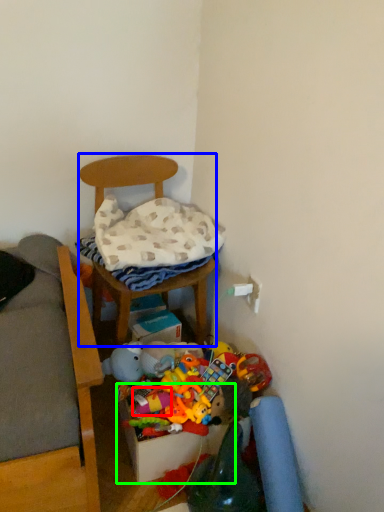
Question: Estimate the real-world distances between objects in this image. Which object is closer to toy (highlighted by a red box), furniture (highlighted by a blue box) or storage box (highlighted by a green box)?

Choices:
 (A) furniture
 (B) storage box

Answer: (B)